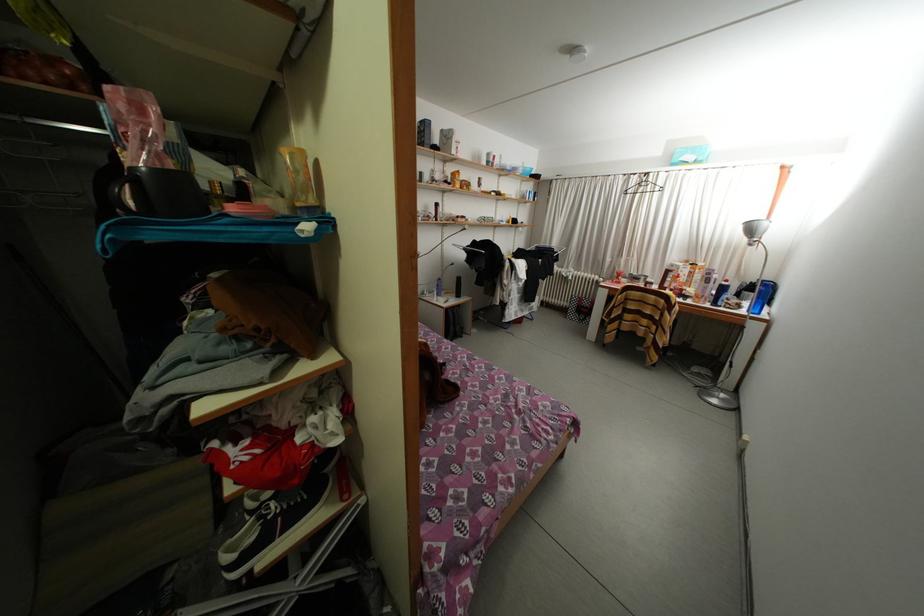
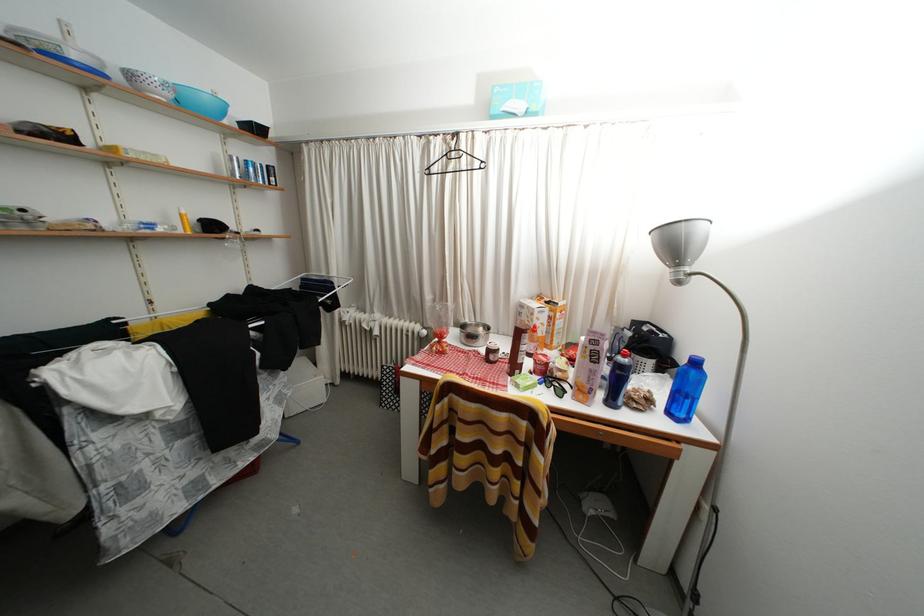
Which direction would the cameraman need to move to produce the second image?

The cameraman moved toward right, forward.